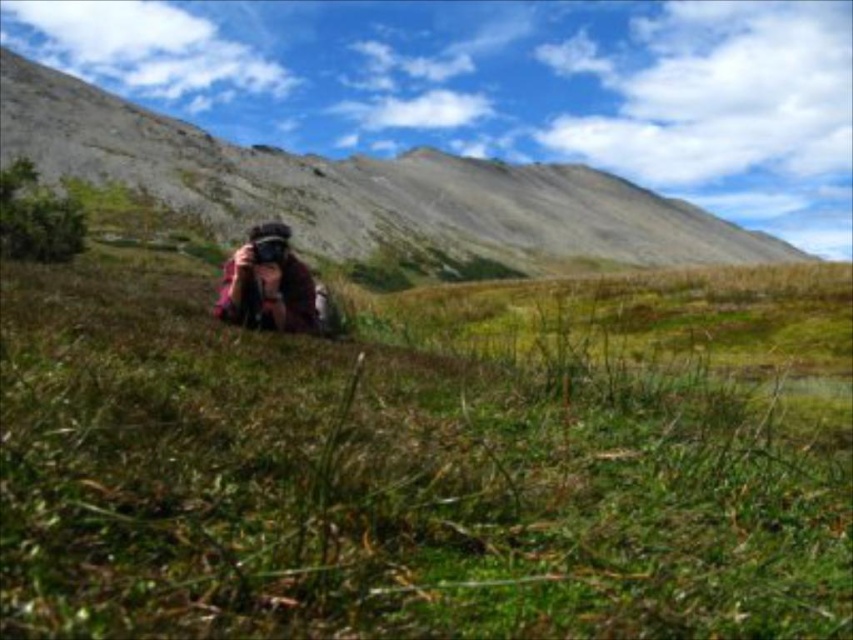
Consider the image. You are standing in the grassy field and want to move from the point closer to you to the point further away. Which path should you take between the two points, point (367, 182) and point (254, 256)?

The point closer to you is point (367, 182), so you should move towards point (254, 256) which is further away.

You are a photographer trying to set up your matte black camera at center on a stable surface. The smooth gray rock at center is in your way. Can you place the camera on the rock without it tipping over?

The smooth gray rock at center is much taller than the matte black camera at center, so placing the camera on the rock might be unstable due to the height difference. It could tip over easily.